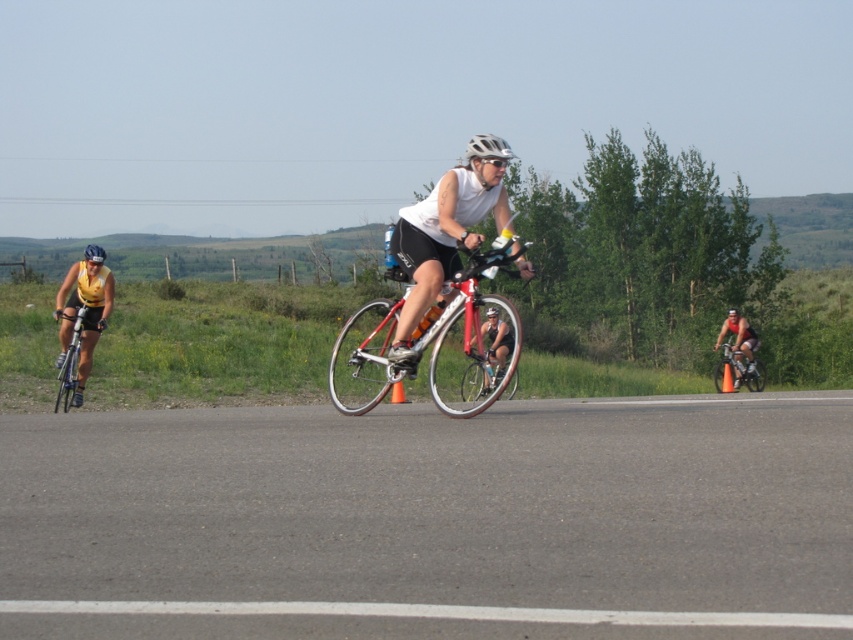
You are a photographer trying to capture a photo of the cyclists. You want to position your camera so that the shiny silver bicycle at left and the white matte helmet at center are both in the frame. Which object should you place on the left side of your camera frame?

The shiny silver bicycle at left should be placed on the left side of your camera frame since it is to the left of the white matte helmet at center according to the description.

You are a cyclist trying to avoid a pothole located at point (x=73, y=356). Which bicycle should you steer away from?

The shiny silver bicycle at left is located at point (x=73, y=356), so you should steer away from the shiny silver bicycle at left.